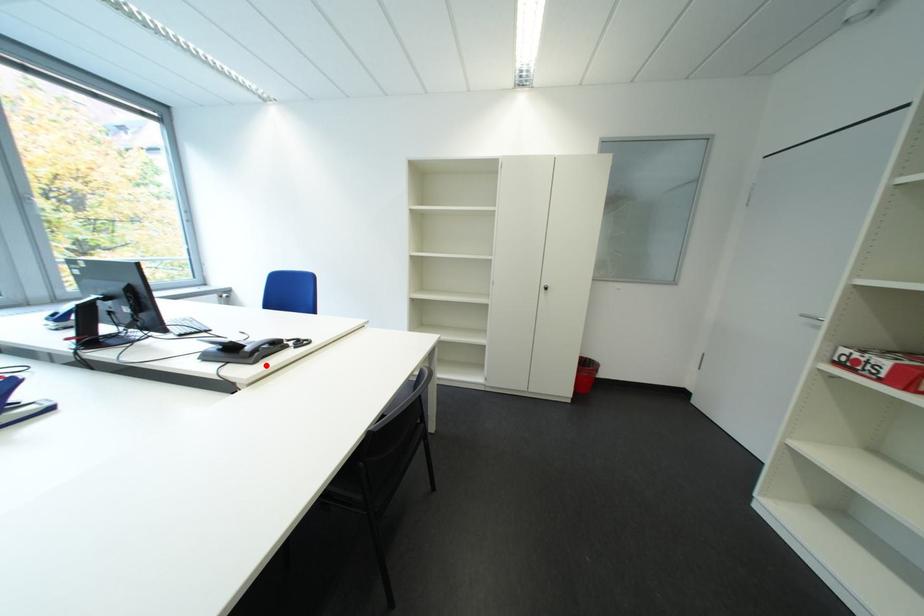
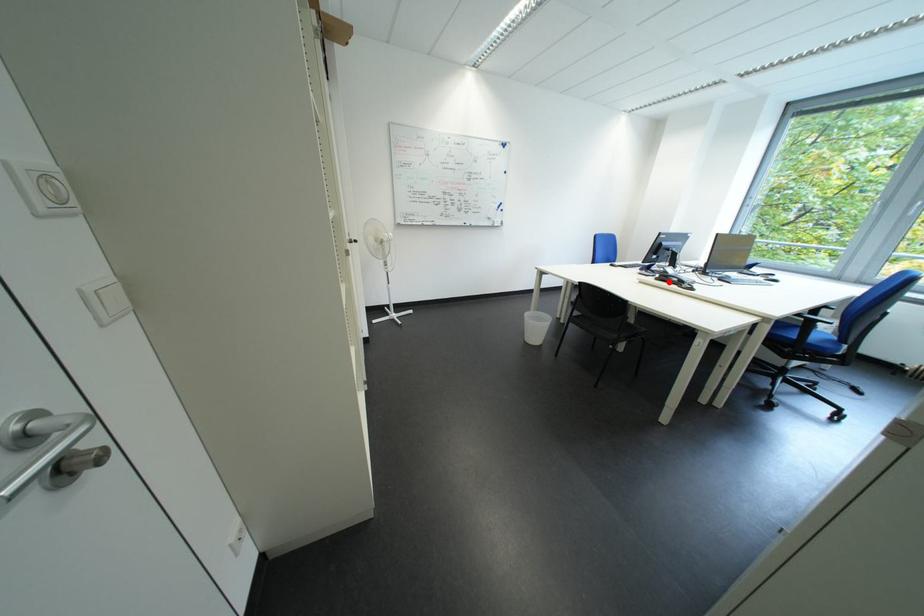
I am providing you with two images of the same scene from different viewpoints. A red point is marked on the first image and another point is marked on the second image. Is the marked point in image1 the same physical position as the marked point in image2?

Yes